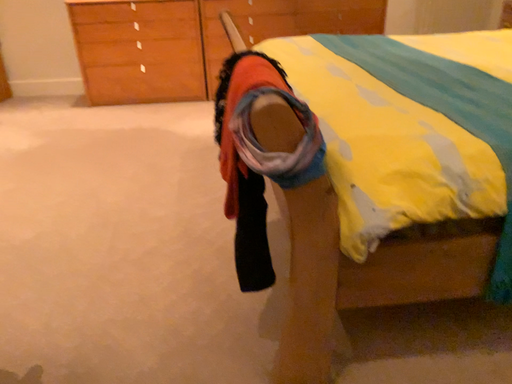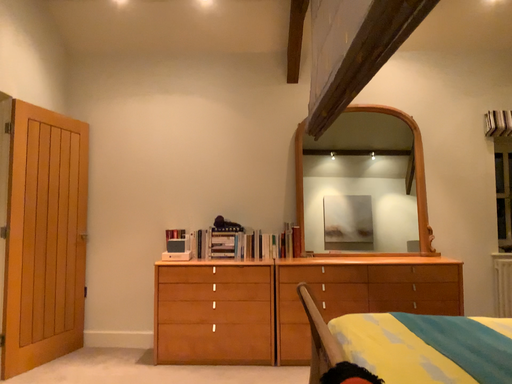
Question: Which way did the camera rotate in the video?

Choices:
 (A) rotated downward
 (B) rotated upward

Answer: (B)